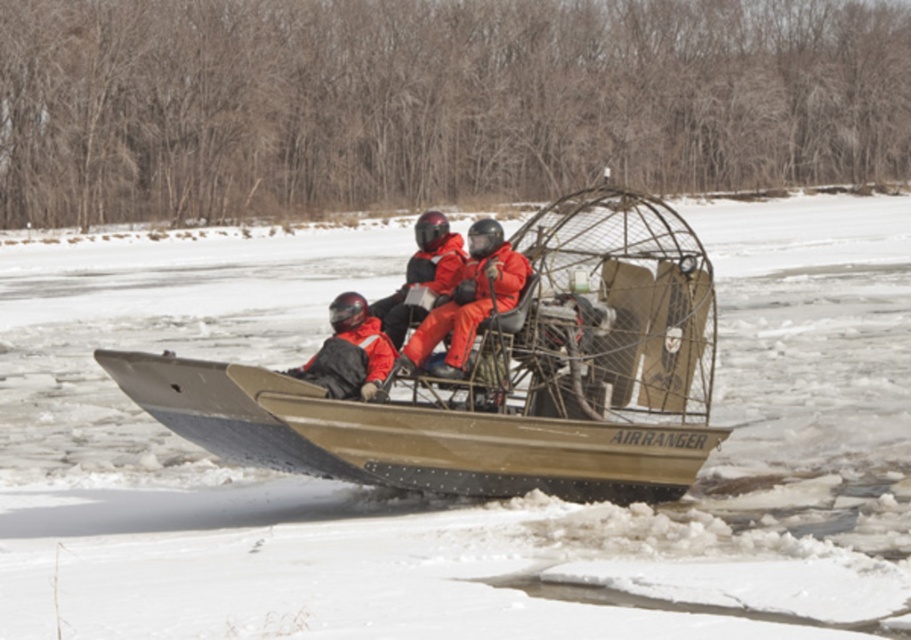
Question: Is brown matte snow at center to the left of matte black jacket at center from the viewer's perspective?

Choices:
 (A) yes
 (B) no

Answer: (B)

Question: Among these points, which one is nearest to the camera?

Choices:
 (A) (441, 371)
 (B) (528, 380)
 (C) (389, 369)
 (D) (252, 540)

Answer: (D)

Question: Where is matte orange jacket at center located in relation to orange matte jacket at center in the image?

Choices:
 (A) right
 (B) left

Answer: (A)

Question: Estimate the real-world distances between objects in this image. Which object is farther from the brown matte snow at center?

Choices:
 (A) orange matte jacket at center
 (B) matte khaki airboat at center

Answer: (A)

Question: Is brown matte snow at center bigger than matte khaki airboat at center?

Choices:
 (A) yes
 (B) no

Answer: (A)

Question: Which object is farther from the camera taking this photo?

Choices:
 (A) brown matte snow at center
 (B) matte black jacket at center
 (C) matte orange jacket at center

Answer: (C)